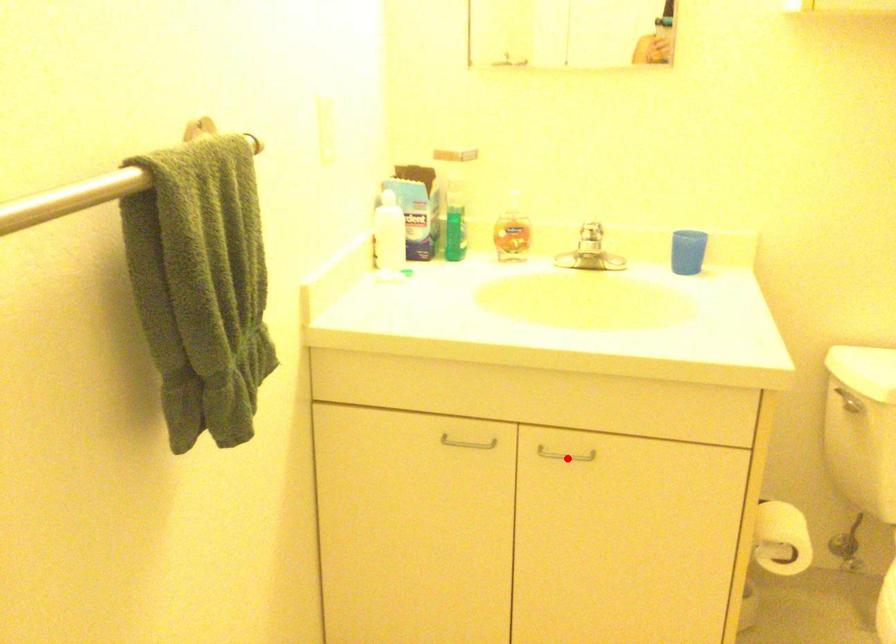
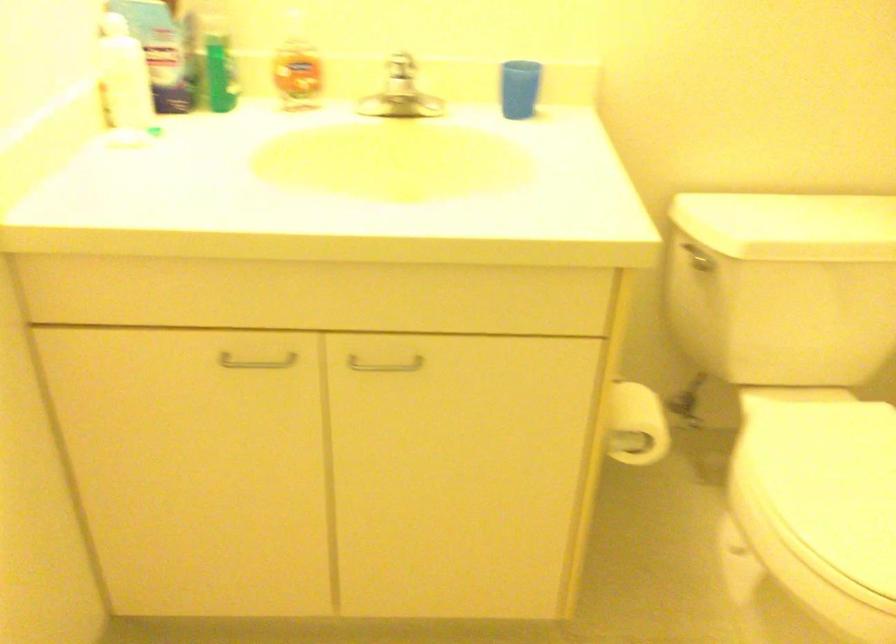
Question: I am providing you with two images of the same scene from different viewpoints. A red point is shown in image1. For the corresponding object point in image2, is it positioned nearer or farther from the camera?

Choices:
 (A) Nearer
 (B) Farther

Answer: (A)